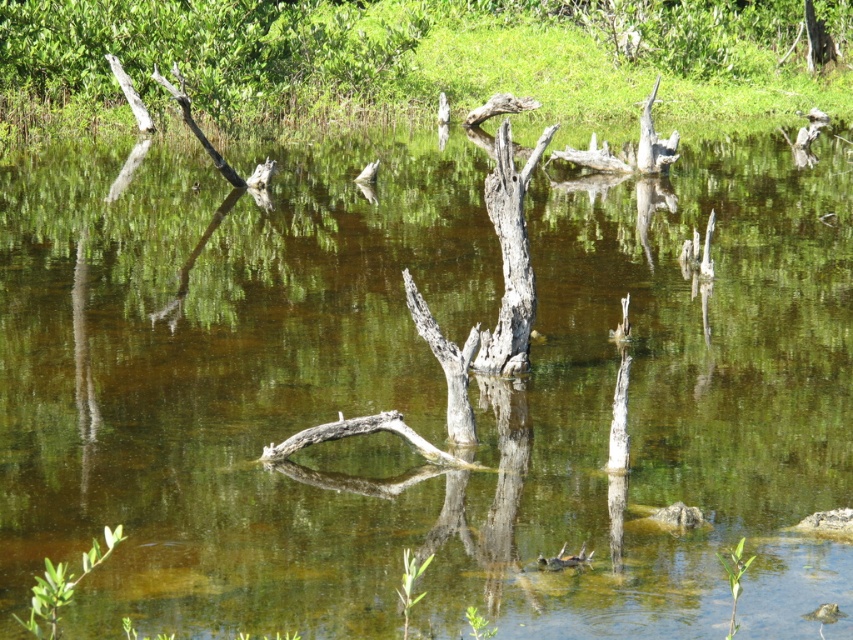
In the scene shown: Can you confirm if dead wood at upper center is wider than smooth brown tree trunk at upper left?

Yes.

Between dead wood at upper center and smooth brown tree trunk at upper left, which one has more height?

dead wood at upper center

Is point (747, 38) farther from camera compared to point (225, 22)?

Yes, it is.

Image resolution: width=853 pixels, height=640 pixels. I want to click on dead wood at upper center, so click(427, 52).

Is dead wood at upper center positioned in front of gray rough tree trunk at center?

That is False.

Between dead wood at upper center and gray rough tree trunk at center, which one is positioned lower?

gray rough tree trunk at center is lower down.

Is point (637, 84) in front of point (492, 216)?

That is False.

Find the location of `dead wood at upper center`. dead wood at upper center is located at coordinates (427, 52).

Is smooth brown tree trunk at upper left below gray rough tree trunk at center?

No.

Is point (73, 83) positioned behind point (521, 352)?

Yes, it is behind point (521, 352).

Is point (233, 99) closer to viewer compared to point (474, 365)?

No, it is not.

Where is `smooth brown tree trunk at upper left`? The height and width of the screenshot is (640, 853). smooth brown tree trunk at upper left is located at coordinates (207, 51).